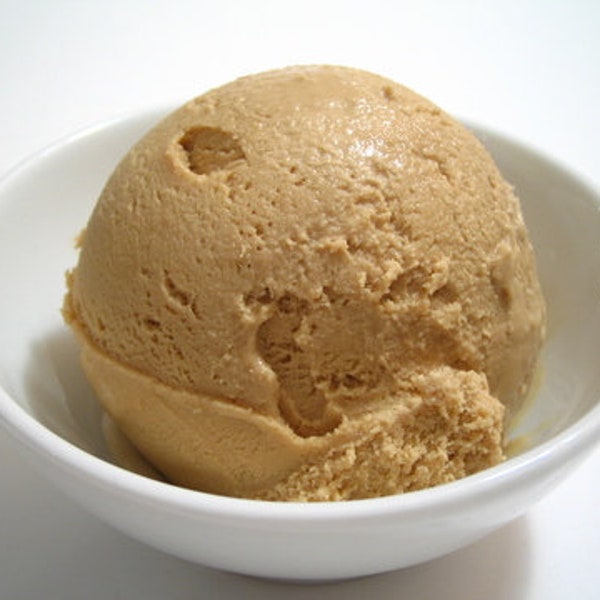
Find the location of `gray shadow inside bowl`. gray shadow inside bowl is located at coordinates (83, 402).